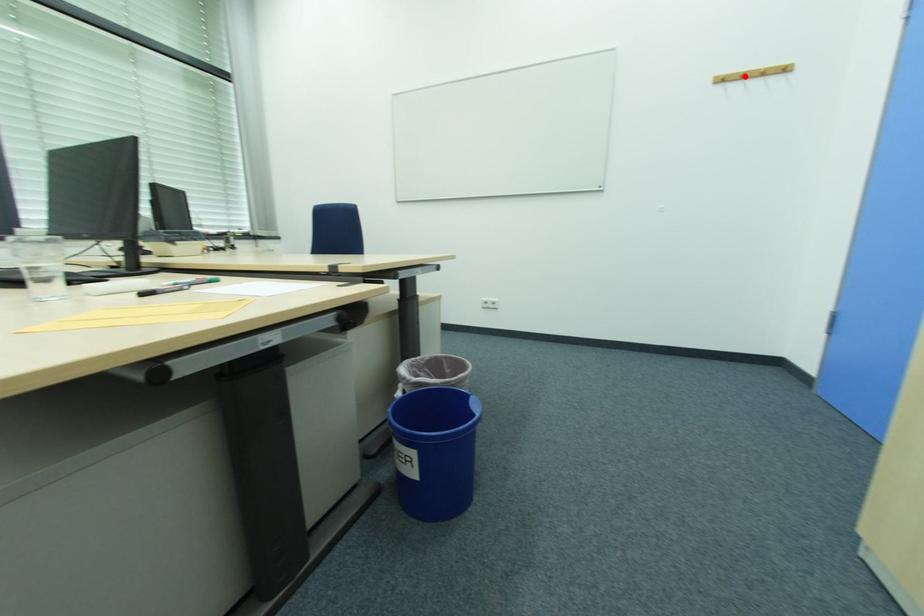
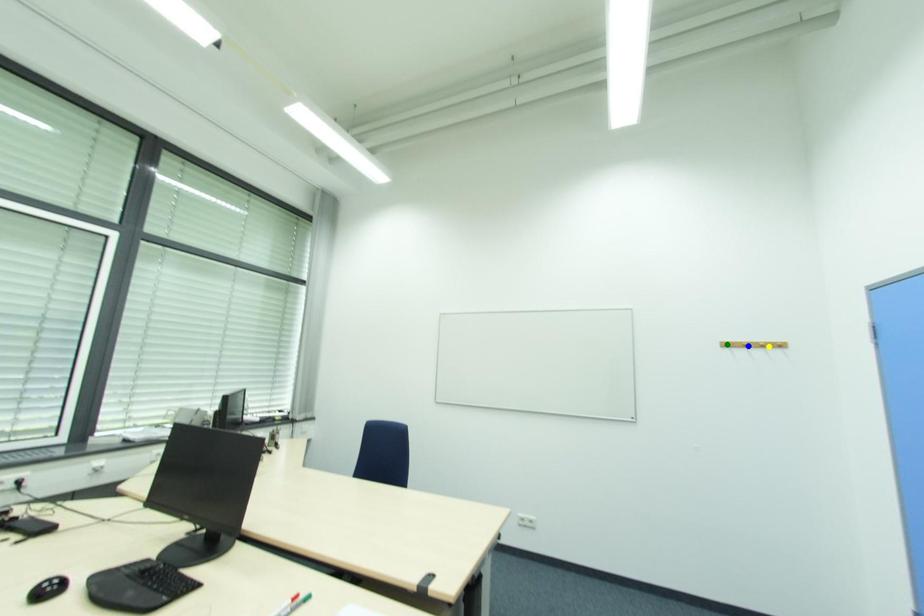
Question: I am providing you with two images of the same scene from different viewpoints. A red point is marked on the first image. You are given multiple points on the second image. Which spot in image 2 lines up with the point in image 1?

Choices:
 (A) blue point
 (B) green point
 (C) yellow point

Answer: (A)